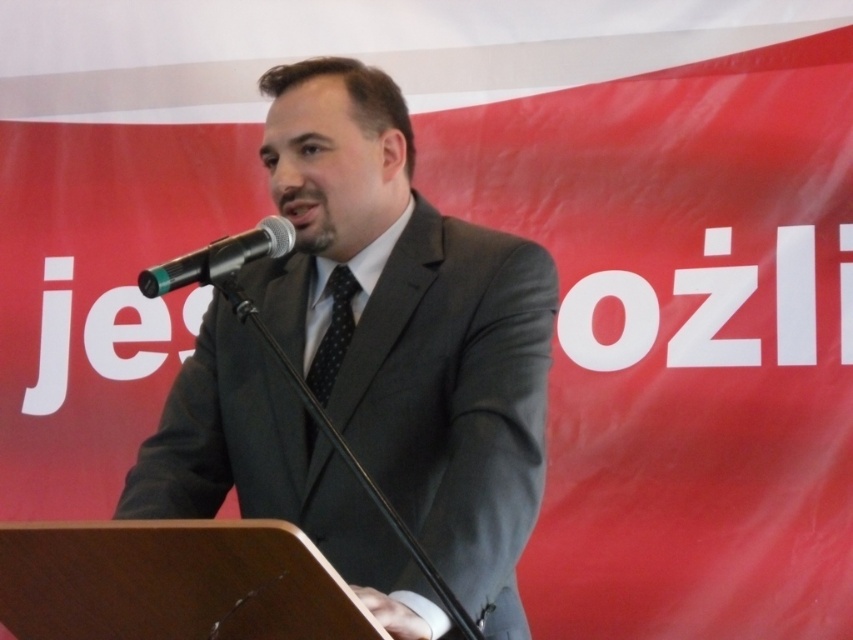
You are a photographer at the event and need to adjust the lighting so that both the black metallic microphone at center and the black dotted tie at center are clearly visible. Since the microphone is shorter than the tie, where should you position the light source to ensure both are well lit?

The black metallic microphone at center is shorter than the black dotted tie at center. To ensure both are well lit, position the light source above the microphone so that it illuminates both objects effectively.

You are a photographer at the event and want to capture a closeup of the speaker without the microphone blocking his face. Based on the scene, can you adjust your camera angle so that the matte gray suit at center is visible but the black metallic microphone at center is not in the frame?

The matte gray suit at center is positioned under the black metallic microphone at center, so if you angle the camera slightly downward, you can capture the speaker in his matte gray suit at center while avoiding the microphone at the top of the frame.